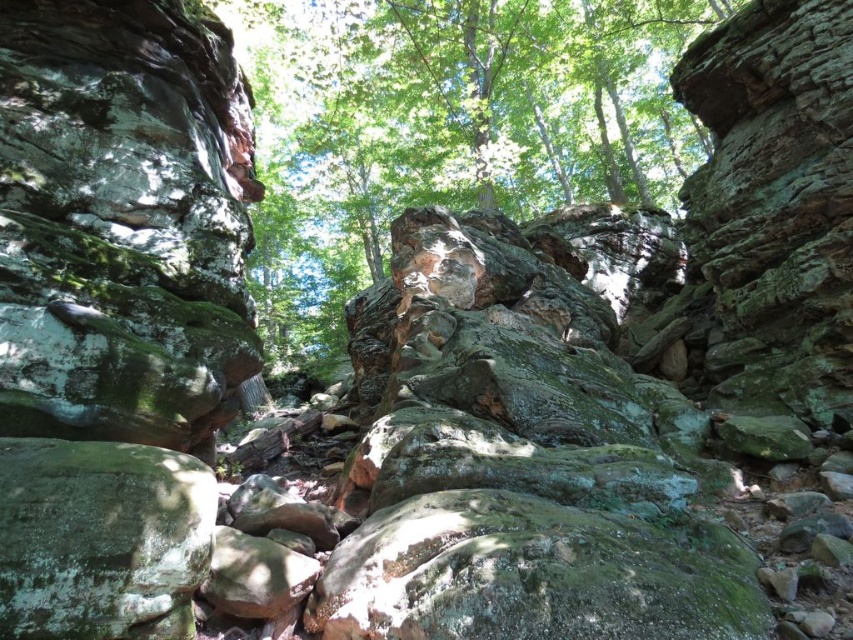
Question: Is green mossy rock at center bigger than green mossy rock at lower left?

Choices:
 (A) no
 (B) yes

Answer: (B)

Question: Which object is closer to the camera taking this photo?

Choices:
 (A) green mossy rock at center
 (B) green mossy rock at lower left

Answer: (B)

Question: Can you confirm if green mossy rock at center is bigger than green mossy rock at lower left?

Choices:
 (A) yes
 (B) no

Answer: (A)

Question: Does green mossy rock at center have a larger size compared to green mossy rock at lower left?

Choices:
 (A) no
 (B) yes

Answer: (B)

Question: Which of the following is the farthest from the observer?

Choices:
 (A) (67, 618)
 (B) (503, 51)

Answer: (B)